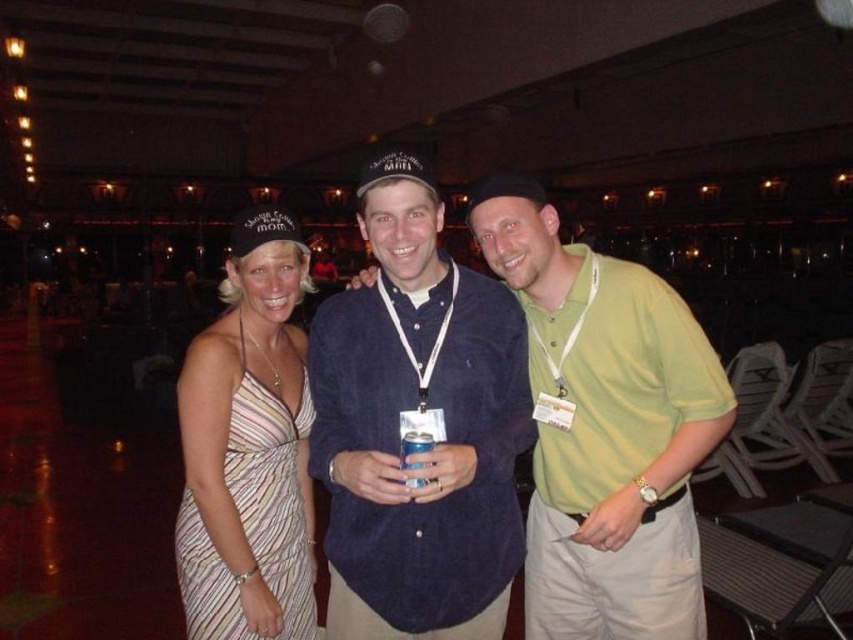
Question: Does striped fabric dress at left appear on the right side of blue plastic can at center?

Choices:
 (A) yes
 (B) no

Answer: (B)

Question: Which object is farther from the camera taking this photo?

Choices:
 (A) blue plastic can at center
 (B) striped fabric dress at center
 (C) striped fabric dress at left

Answer: (C)

Question: Which object is the farthest from the striped fabric dress at center?

Choices:
 (A) blue plastic can at center
 (B) green cotton polo shirt at center
 (C) striped fabric dress at left

Answer: (A)

Question: Which point appears farthest from the camera in this image?

Choices:
 (A) (405, 464)
 (B) (311, 636)
 (C) (683, 605)

Answer: (B)

Question: Does striped fabric dress at center lie behind green cotton polo shirt at center?

Choices:
 (A) yes
 (B) no

Answer: (B)

Question: Is striped fabric dress at left smaller than blue plastic can at center?

Choices:
 (A) no
 (B) yes

Answer: (A)